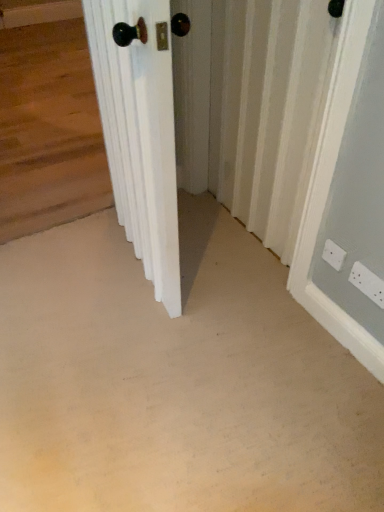
Find the location of a particular element. unoccupied region to the right of white wooden door at center is located at coordinates (226, 272).